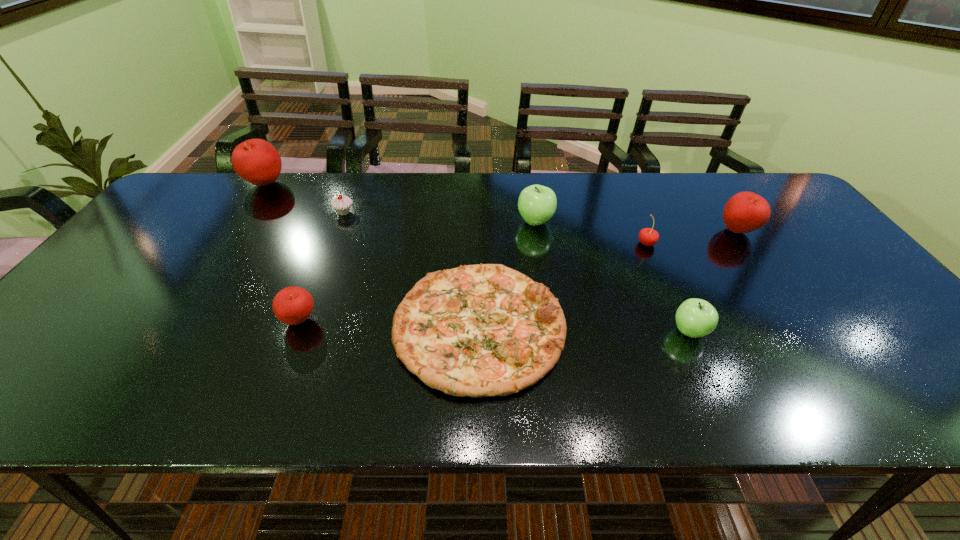
This screenshot has width=960, height=540. Find the location of `the smallest red apple`. the smallest red apple is located at coordinates (293, 305).

Where is `the second red apple from right to left`? This screenshot has height=540, width=960. the second red apple from right to left is located at coordinates (293, 305).

Locate an element on the screen. The image size is (960, 540). the shortest object is located at coordinates (485, 330).

Image resolution: width=960 pixels, height=540 pixels. What are the coordinates of `brown pizza` in the screenshot? It's located at (485, 330).

Locate an element on the screen. This screenshot has width=960, height=540. blank area located on the left of the leftmost apple is located at coordinates (190, 185).

This screenshot has height=540, width=960. In order to click on vacant region located on the back of the bigger green apple in this screenshot , I will do `click(529, 180)`.

Where is `free space located 0.250m on the left of the second nearest red apple`? free space located 0.250m on the left of the second nearest red apple is located at coordinates (631, 231).

You are a GUI agent. You are given a task and a screenshot of the screen. Output one action in this format:
    pyautogui.click(x=<x>, y=<y>)
    Task: Click on the free space located on the right of the cupcake
    The height and width of the screenshot is (540, 960).
    Given the screenshot: What is the action you would take?
    pyautogui.click(x=400, y=213)

Locate an element on the screen. This screenshot has width=960, height=540. vacant area situated on the left of the cherry is located at coordinates (497, 244).

Image resolution: width=960 pixels, height=540 pixels. I want to click on vacant space located 0.060m on the back of the nearer green apple, so click(676, 299).